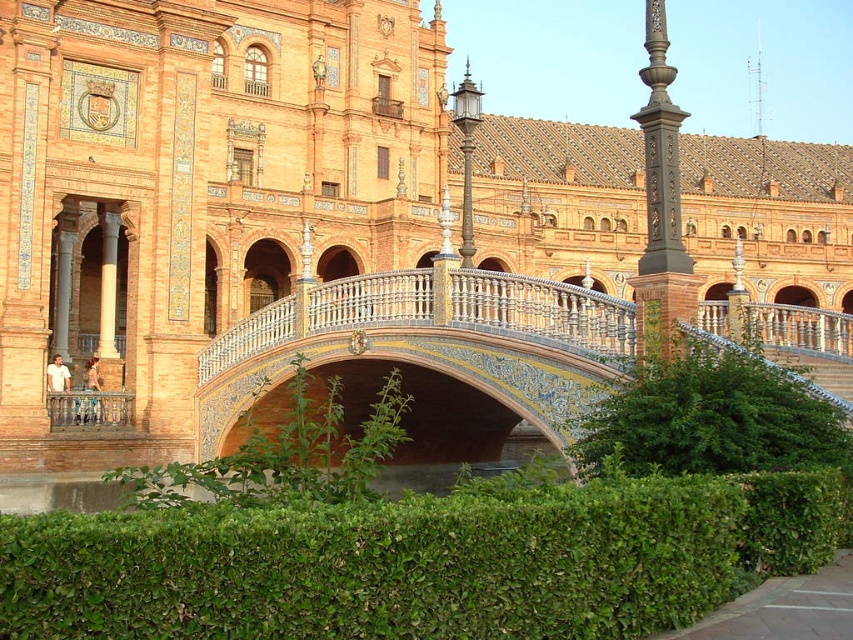
Is green leafy hedge at lower center shorter than green leafy hedge at center?

Yes, green leafy hedge at lower center is shorter than green leafy hedge at center.

Does green leafy hedge at lower center come in front of green leafy hedge at center?

No, green leafy hedge at lower center is further to the viewer.

Is point (714, 461) positioned after point (360, 490)?

Yes, it is.

Locate an element on the screen. The height and width of the screenshot is (640, 853). green leafy hedge at lower center is located at coordinates (726, 403).

In the scene shown: Can you confirm if decorative ceramic bridge at center is positioned below green leafy hedge at lower center?

Indeed, decorative ceramic bridge at center is positioned under green leafy hedge at lower center.

Which of these two, decorative ceramic bridge at center or green leafy hedge at lower center, stands shorter?

green leafy hedge at lower center

Find the location of `decorative ceramic bridge at center`. decorative ceramic bridge at center is located at coordinates (432, 340).

Who is more forward, (x=688, y=403) or (x=663, y=253)?

Positioned in front is point (x=688, y=403).

Is green leafy hedge at lower center to the left of dark brown ornate post at center from the viewer's perspective?

Correct, you'll find green leafy hedge at lower center to the left of dark brown ornate post at center.

What do you see at coordinates (726, 403) in the screenshot? The height and width of the screenshot is (640, 853). I see `green leafy hedge at lower center` at bounding box center [726, 403].

Identify the location of green leafy hedge at lower center. (726, 403).